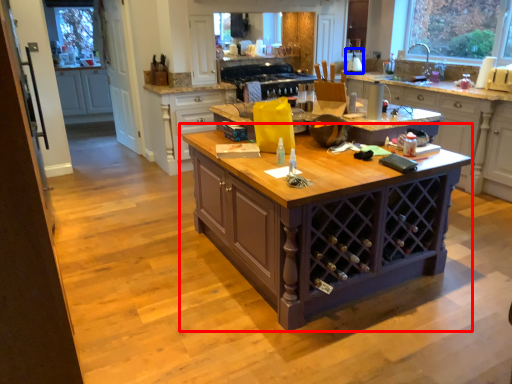
Question: Which point is closer to the camera, table (highlighted by a red box) or appliance (highlighted by a blue box)?

Choices:
 (A) table
 (B) appliance

Answer: (A)